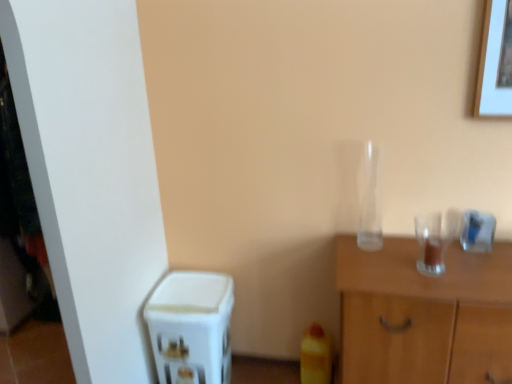
Question: Is white plastic water dispenser at lower left facing away from transparent glass vase at center-right?

Choices:
 (A) yes
 (B) no

Answer: (B)

Question: Can you confirm if white plastic water dispenser at lower left is positioned to the right of transparent glass vase at center-right?

Choices:
 (A) yes
 (B) no

Answer: (B)

Question: Could you tell me if white plastic water dispenser at lower left is turned towards transparent glass vase at center-right?

Choices:
 (A) no
 (B) yes

Answer: (A)

Question: Is white plastic water dispenser at lower left at the left side of transparent glass vase at center-right?

Choices:
 (A) yes
 (B) no

Answer: (A)

Question: Are white plastic water dispenser at lower left and transparent glass vase at center-right far apart?

Choices:
 (A) yes
 (B) no

Answer: (B)

Question: From the image's perspective, would you say white plastic water dispenser at lower left is shown under transparent glass vase at center-right?

Choices:
 (A) yes
 (B) no

Answer: (A)

Question: Would you say transparent glass cabinet at right is a long distance from white plastic water dispenser at lower left?

Choices:
 (A) yes
 (B) no

Answer: (B)

Question: Does transparent glass cabinet at right have a lesser width compared to white plastic water dispenser at lower left?

Choices:
 (A) yes
 (B) no

Answer: (B)

Question: Does transparent glass cabinet at right appear on the right side of white plastic water dispenser at lower left?

Choices:
 (A) yes
 (B) no

Answer: (A)

Question: Is transparent glass cabinet at right oriented away from white plastic water dispenser at lower left?

Choices:
 (A) yes
 (B) no

Answer: (B)

Question: Can white plastic water dispenser at lower left be found inside transparent glass cabinet at right?

Choices:
 (A) no
 (B) yes

Answer: (A)

Question: Is transparent glass cabinet at right in contact with white plastic water dispenser at lower left?

Choices:
 (A) no
 (B) yes

Answer: (A)

Question: Can you confirm if transparent glass vase at center-right is positioned to the left of white plastic water dispenser at lower left?

Choices:
 (A) yes
 (B) no

Answer: (B)